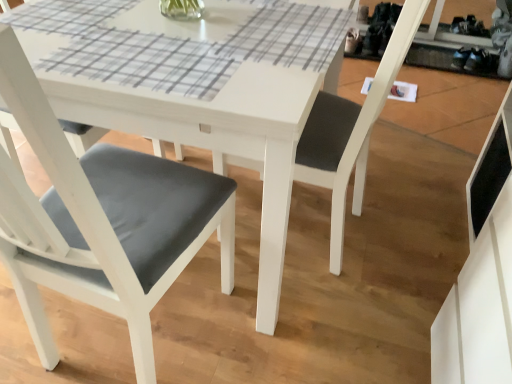
Question: From the image's perspective, would you say matte gray cushion at lower left, which appears as the 2th chair when viewed from the right, is shown under matte gray cushion at center, the second chair viewed from the left?

Choices:
 (A) no
 (B) yes

Answer: (A)

Question: From a real-world perspective, does matte gray cushion at lower left, placed as the first chair when sorted from left to right, sit lower than matte gray cushion at center, the second chair viewed from the left?

Choices:
 (A) no
 (B) yes

Answer: (B)

Question: Considering the relative sizes of matte gray cushion at lower left, placed as the first chair when sorted from left to right, and matte gray cushion at center, which is the 1th chair from right to left, in the image provided, is matte gray cushion at lower left, placed as the first chair when sorted from left to right, shorter than matte gray cushion at center, which is the 1th chair from right to left,?

Choices:
 (A) no
 (B) yes

Answer: (B)

Question: Is matte gray cushion at lower left, which appears as the 2th chair when viewed from the right, aimed at matte gray cushion at center, which is the 1th chair from right to left?

Choices:
 (A) yes
 (B) no

Answer: (B)

Question: Does matte gray cushion at lower left, placed as the first chair when sorted from left to right, have a greater height compared to matte gray cushion at center, the second chair viewed from the left?

Choices:
 (A) no
 (B) yes

Answer: (A)

Question: Does matte gray cushion at lower left, placed as the first chair when sorted from left to right, appear on the left side of matte gray cushion at center, the second chair viewed from the left?

Choices:
 (A) yes
 (B) no

Answer: (A)

Question: From the image's perspective, is matte gray cushion at center, which is the 1th chair from right to left, on matte gray cushion at lower left, placed as the first chair when sorted from left to right?

Choices:
 (A) yes
 (B) no

Answer: (B)

Question: From a real-world perspective, is matte gray cushion at center, which is the 1th chair from right to left, over matte gray cushion at lower left, which appears as the 2th chair when viewed from the right?

Choices:
 (A) no
 (B) yes

Answer: (B)

Question: Can you confirm if matte gray cushion at center, which is the 1th chair from right to left, is smaller than matte gray cushion at lower left, placed as the first chair when sorted from left to right?

Choices:
 (A) yes
 (B) no

Answer: (A)

Question: Does matte gray cushion at center, which is the 1th chair from right to left, appear on the right side of matte gray cushion at lower left, which appears as the 2th chair when viewed from the right?

Choices:
 (A) no
 (B) yes

Answer: (B)

Question: Is matte gray cushion at center, which is the 1th chair from right to left, taller than matte gray cushion at lower left, placed as the first chair when sorted from left to right?

Choices:
 (A) no
 (B) yes

Answer: (B)

Question: Does matte gray cushion at center, the second chair viewed from the left, have a larger size compared to matte gray cushion at lower left, which appears as the 2th chair when viewed from the right?

Choices:
 (A) no
 (B) yes

Answer: (A)

Question: From the image's perspective, is matte gray cushion at lower left, placed as the first chair when sorted from left to right, above or below matte gray cushion at center, the second chair viewed from the left?

Choices:
 (A) below
 (B) above

Answer: (B)